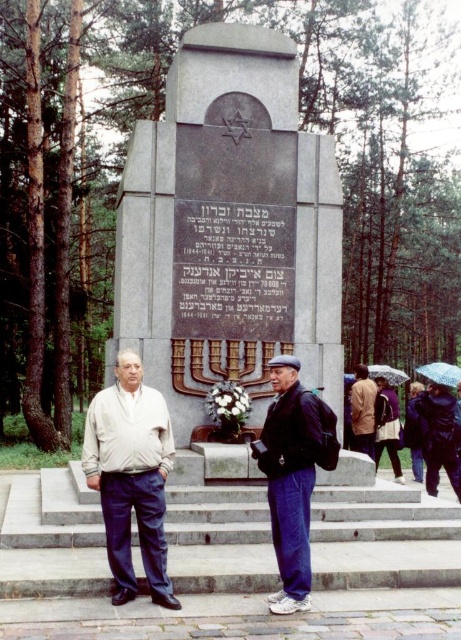
From the picture: You are standing at the memorial site and want to place the light beige sweater at center on the gray concrete stairs at center. Based on their sizes, will the sweater fit comfortably on the stairs?

The gray concrete stairs at center is larger in size than light beige sweater at center, so the sweater will fit comfortably on the stairs.